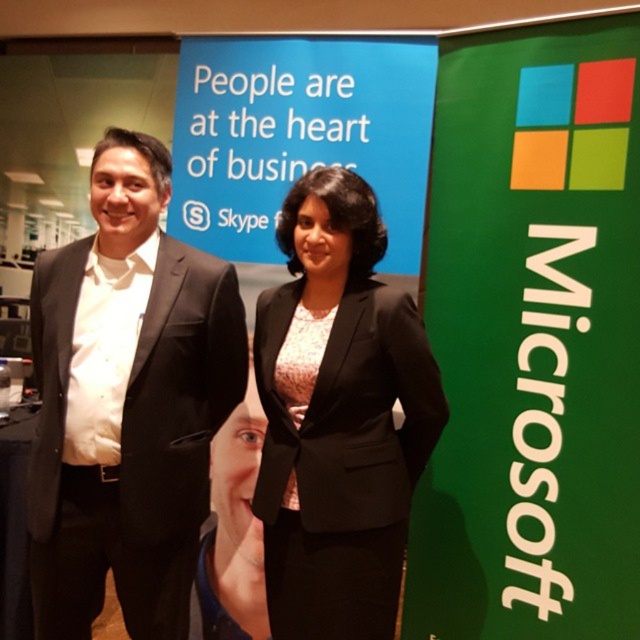
Question: Can you confirm if green matte microsoft sign at right is positioned to the right of black matte suit at left?

Choices:
 (A) no
 (B) yes

Answer: (B)

Question: Is green matte microsoft sign at right to the right of smooth skin face at center from the viewer's perspective?

Choices:
 (A) yes
 (B) no

Answer: (A)

Question: Which of the following is the closest to the observer?

Choices:
 (A) (352, 528)
 (B) (428, 278)

Answer: (A)

Question: Which object is closer to the camera taking this photo?

Choices:
 (A) black matte suit at left
 (B) black glossy suit at center
 (C) black fabric suit at center

Answer: (A)

Question: Can you confirm if black fabric suit at center is positioned above pink textured dress at center?

Choices:
 (A) no
 (B) yes

Answer: (A)

Question: Estimate the real-world distances between objects in this image. Which object is farther from the green matte microsoft sign at right?

Choices:
 (A) smooth skin face at center
 (B) black fabric suit at center

Answer: (A)